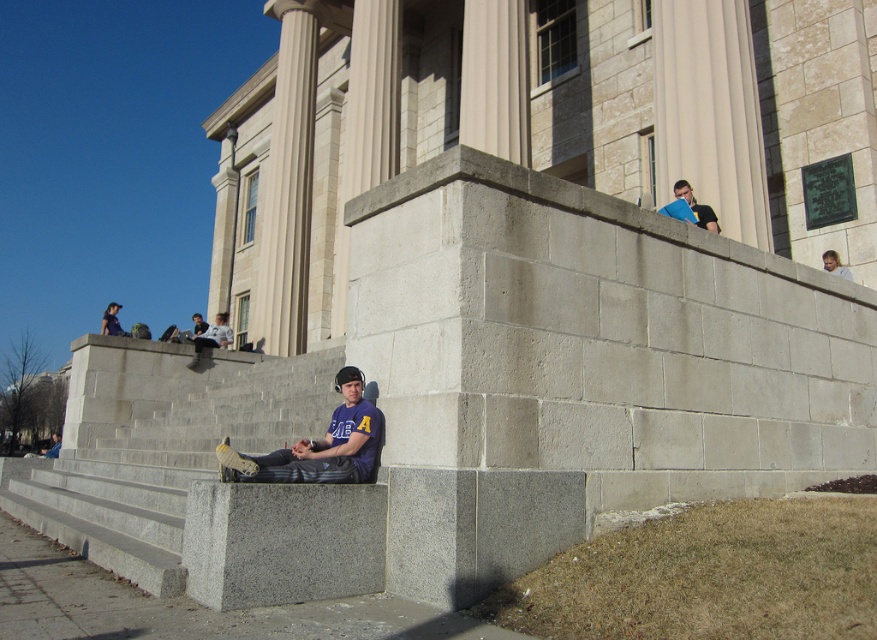
Between point (386, 488) and point (290, 454), which one is positioned behind?

Positioned behind is point (290, 454).

Is gray granite concrete at lower center in front of purple fabric shirt at lower center?

Yes, it is.

Image resolution: width=877 pixels, height=640 pixels. I want to click on gray granite concrete at lower center, so pos(282,541).

Locate an element on the screen. This screenshot has width=877, height=640. gray granite concrete at lower center is located at coordinates (282, 541).

Looking at this image, can you confirm if gray granite concrete at lower center is shorter than dark blue shirt at upper left?

Yes.

Who is lower down, gray granite concrete at lower center or dark blue shirt at upper left?

gray granite concrete at lower center is below.

The height and width of the screenshot is (640, 877). What do you see at coordinates (282, 541) in the screenshot? I see `gray granite concrete at lower center` at bounding box center [282, 541].

Where is `gray granite concrete at lower center`? The image size is (877, 640). gray granite concrete at lower center is located at coordinates (282, 541).

Does gray granite concrete at lower center have a lesser width compared to light brown hair at upper right?

Incorrect, gray granite concrete at lower center's width is not less than light brown hair at upper right's.

Measure the distance from gray granite concrete at lower center to light brown hair at upper right.

gray granite concrete at lower center and light brown hair at upper right are 9.27 meters apart from each other.

Does point (369, 504) come behind point (836, 273)?

No, (369, 504) is closer to viewer.

Locate an element on the screen. gray granite concrete at lower center is located at coordinates (282, 541).